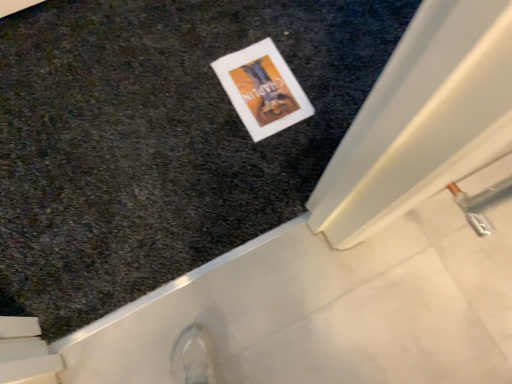
Locate an element on the screen. This screenshot has height=384, width=512. vacant region below white paper at center (from a real-world perspective) is located at coordinates (261, 82).